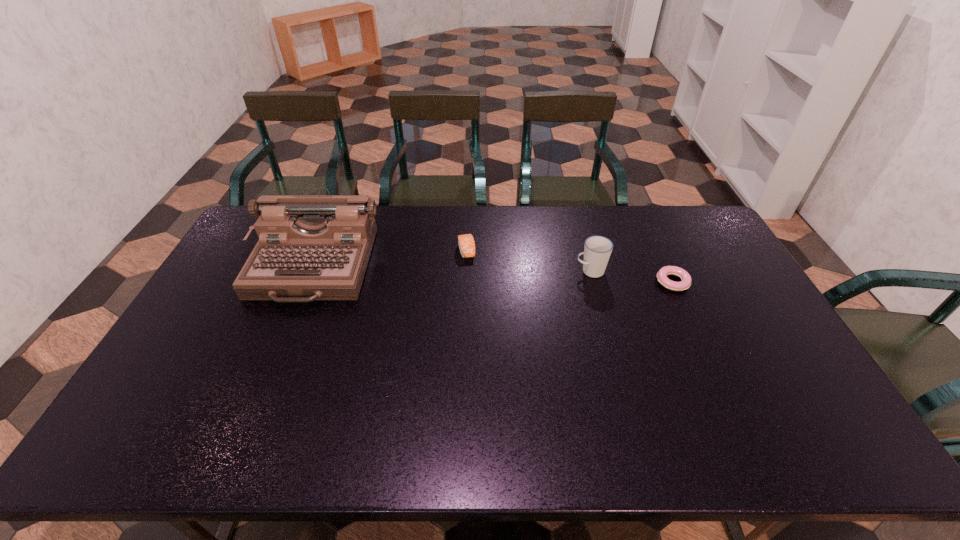
Find the location of a particular element. vacant space positioned 0.360m with a handle on the side of the second object from right to left is located at coordinates tap(467, 271).

Where is `free location located 0.300m with a handle on the side of the second object from right to left`? The image size is (960, 540). free location located 0.300m with a handle on the side of the second object from right to left is located at coordinates (485, 271).

The width and height of the screenshot is (960, 540). I want to click on free space located 0.290m on the right of the sushi, so click(x=558, y=251).

Where is `blank space located on the right of the shortest object`? This screenshot has width=960, height=540. blank space located on the right of the shortest object is located at coordinates (710, 282).

At what (x,y) coordinates should I click in order to perform the action: click on typewriter present at the far edge. Please return your answer as a coordinate pair (x, y). This screenshot has width=960, height=540. Looking at the image, I should click on (311, 247).

Image resolution: width=960 pixels, height=540 pixels. Find the location of `sushi at the far edge`. sushi at the far edge is located at coordinates (466, 243).

In order to click on object that is positioned at the left edge in this screenshot , I will do `click(311, 247)`.

Where is `object present at the far left corner`? This screenshot has height=540, width=960. object present at the far left corner is located at coordinates (311, 247).

Where is `free location at the far edge of the desktop`? The height and width of the screenshot is (540, 960). free location at the far edge of the desktop is located at coordinates (383, 232).

The height and width of the screenshot is (540, 960). I want to click on free space at the near edge, so click(x=421, y=436).